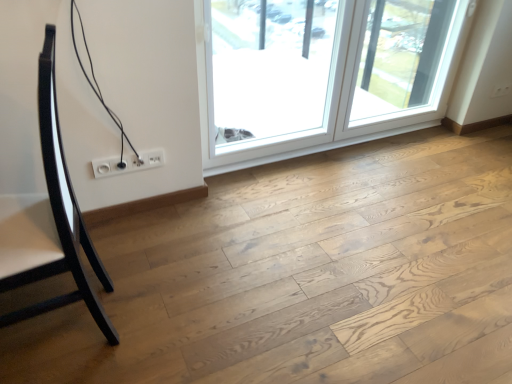
Find the location of a particular element. The width and height of the screenshot is (512, 384). free location in front of transparent glass screen door at upper right is located at coordinates (418, 186).